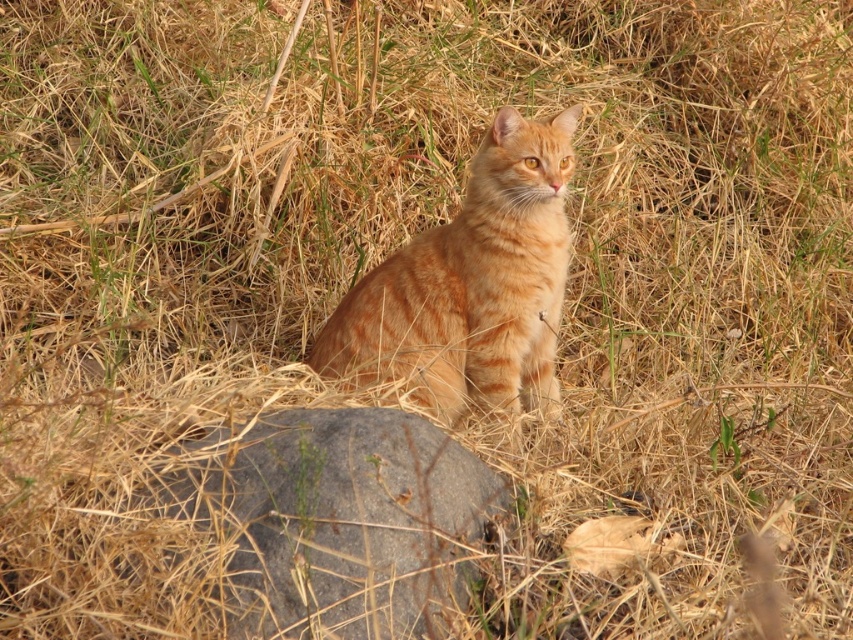
The width and height of the screenshot is (853, 640). What do you see at coordinates (341, 518) in the screenshot?
I see `gray rough stone at lower center` at bounding box center [341, 518].

This screenshot has height=640, width=853. Describe the element at coordinates (341, 518) in the screenshot. I see `gray rough stone at lower center` at that location.

Find the location of a particular element. gray rough stone at lower center is located at coordinates (341, 518).